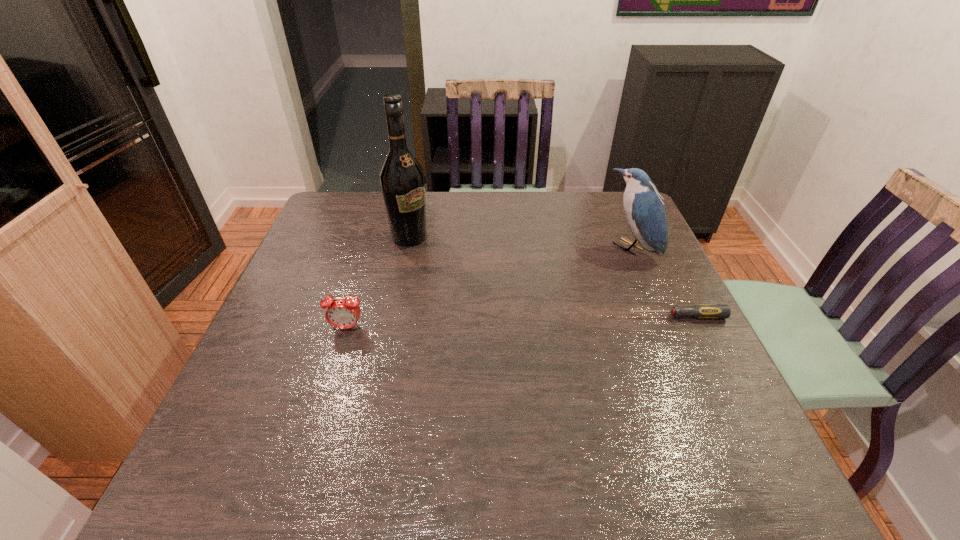
Identify the location of blank area in the image that satisfies the following two spatial constraints: 1. on the front side of the tallest object; 2. insert the screwdriver into a screw head. (394, 316).

The width and height of the screenshot is (960, 540). I want to click on free spot that satisfies the following two spatial constraints: 1. on the front side of the second nearest object; 2. insert the tallest object into a screw head, so click(394, 316).

Where is `free point that satisfies the following two spatial constraints: 1. on the front side of the wine bottle; 2. on the left side of the second tallest object`? Image resolution: width=960 pixels, height=540 pixels. free point that satisfies the following two spatial constraints: 1. on the front side of the wine bottle; 2. on the left side of the second tallest object is located at coordinates (407, 248).